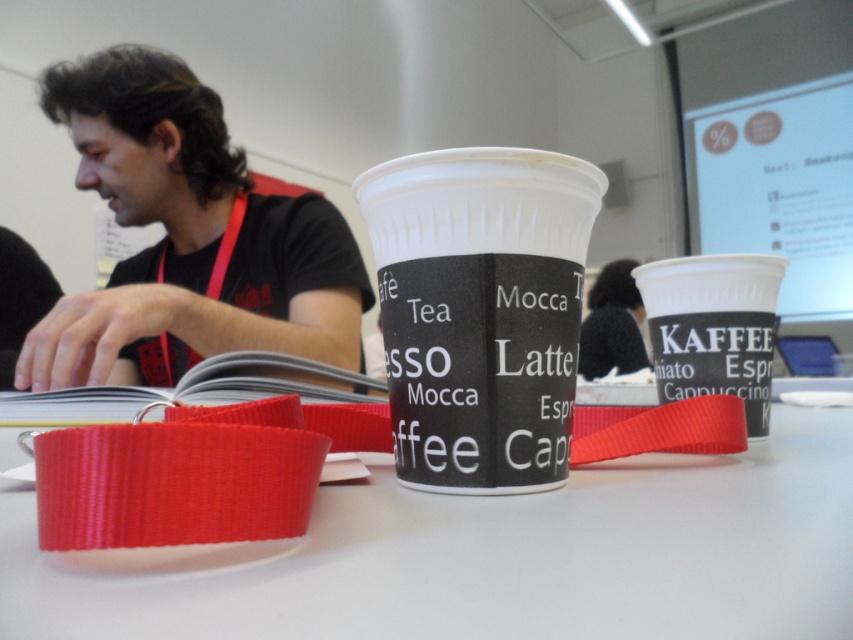
Question: Which of these objects is positioned closest to the white matte paper cup at center?

Choices:
 (A) matte black paper cup at right
 (B) white plastic table at center
 (C) matte black shirt at left

Answer: (B)

Question: Is white plastic table at center wider than white matte paper cup at center?

Choices:
 (A) no
 (B) yes

Answer: (B)

Question: Which point is closer to the camera?

Choices:
 (A) (563, 387)
 (B) (247, 209)
 (C) (370, 573)

Answer: (C)

Question: Which point is farther from the camera taking this photo?

Choices:
 (A) (115, 179)
 (B) (631, 467)

Answer: (A)

Question: Is white matte paper cup at center wider than matte black paper cup at right?

Choices:
 (A) yes
 (B) no

Answer: (A)

Question: Does matte black shirt at left appear on the right side of matte black paper cup at right?

Choices:
 (A) yes
 (B) no

Answer: (B)